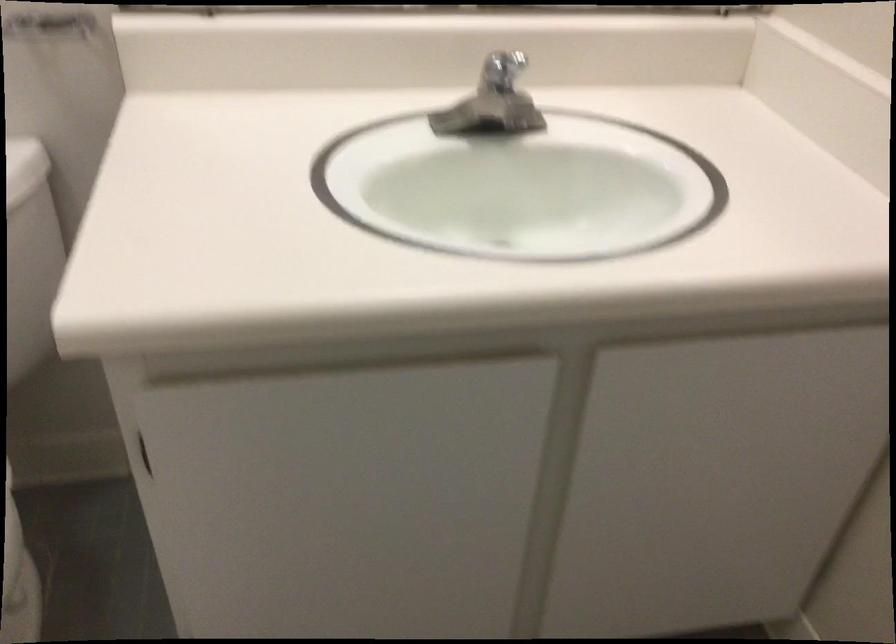
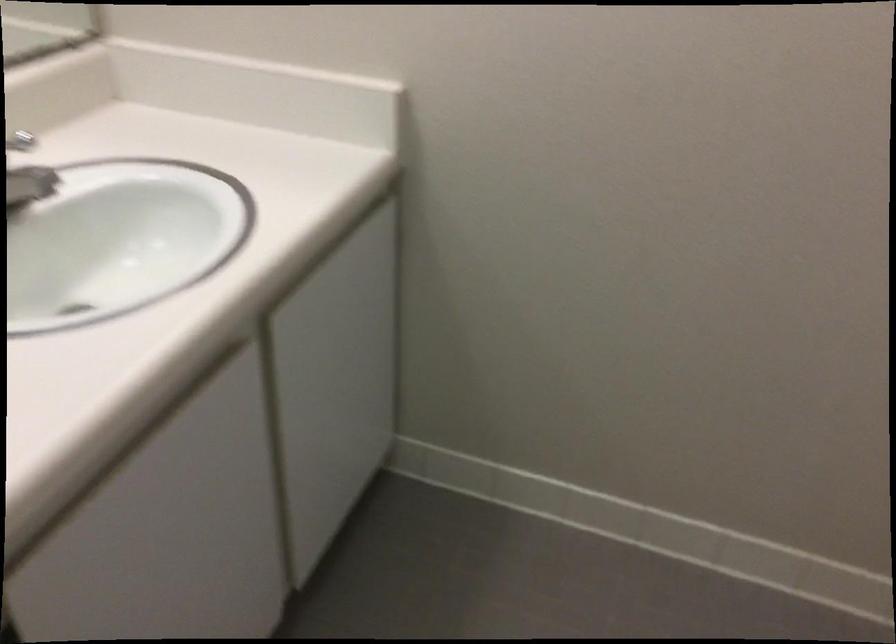
Based on the continuous images, in which direction is the camera rotating?

The rotation direction of the camera is right-down.